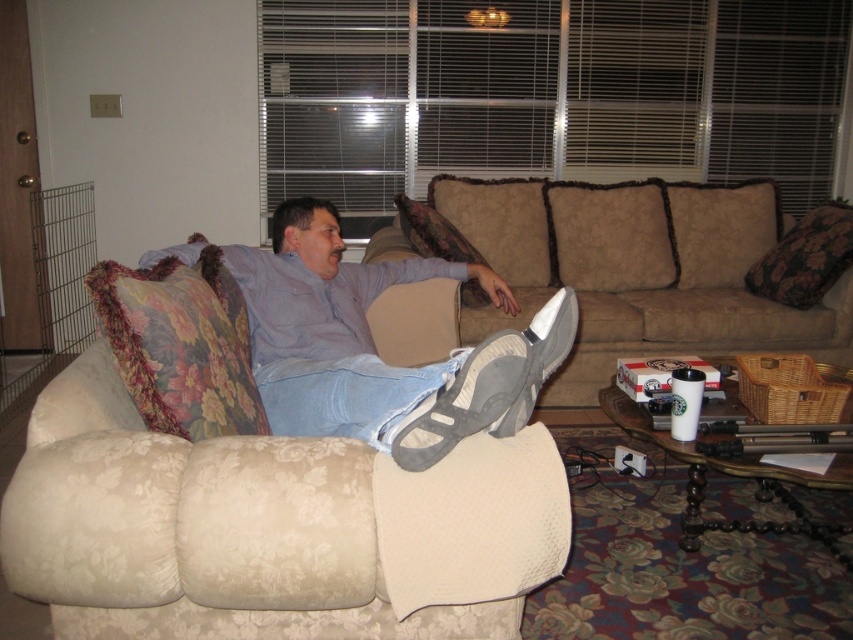
You are a physical therapist visiting a patient in their home. You notice the gray fabric shoe at center and the floral fabric pillow at left in the living room. To ensure proper foot elevation during recovery, which object should you adjust and how?

The gray fabric shoe at center is located above floral fabric pillow at left. To properly elevate the foot, you should place the floral fabric pillow at left under the gray fabric shoe at center to create a higher elevation point.